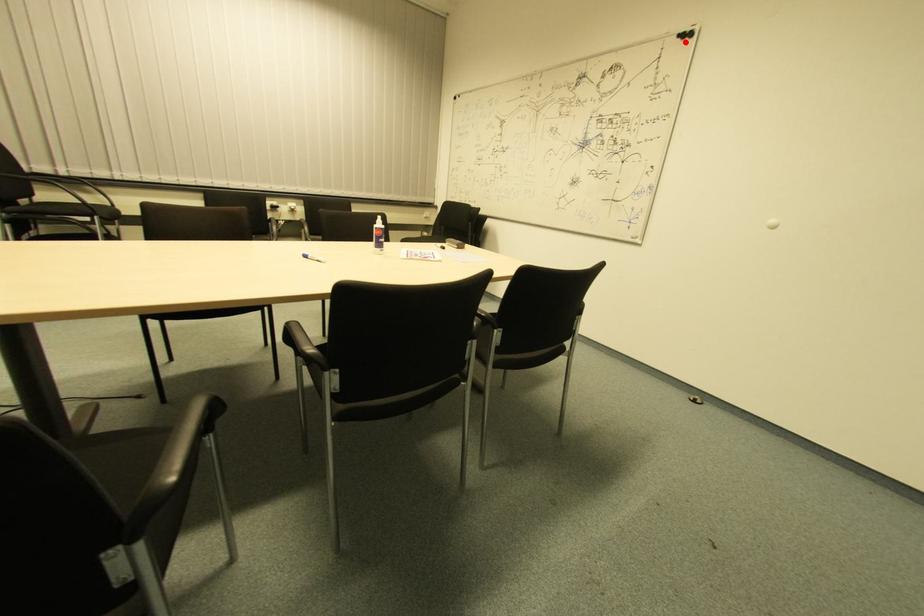
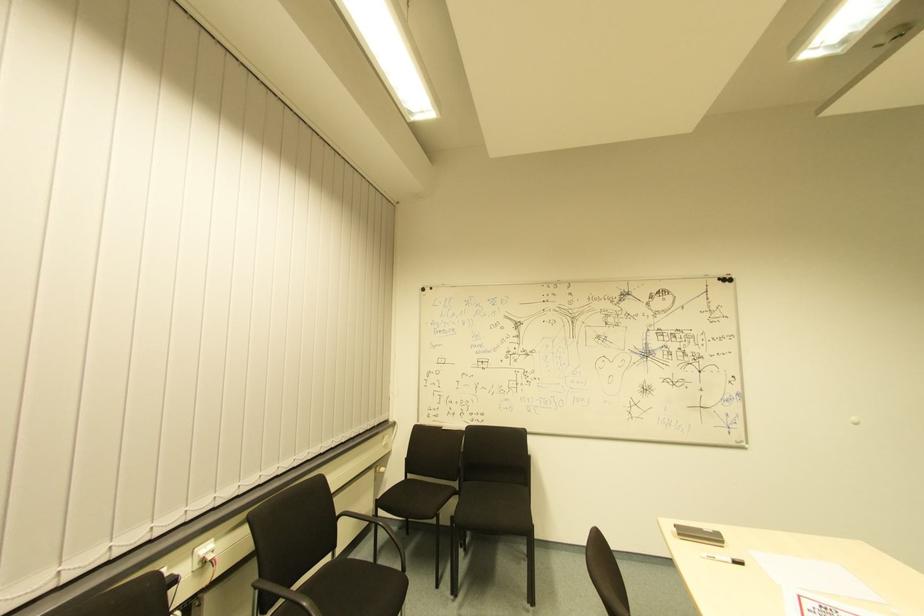
Find the pixel in the second image that matches the highlighted location in the first image.

(725, 286)